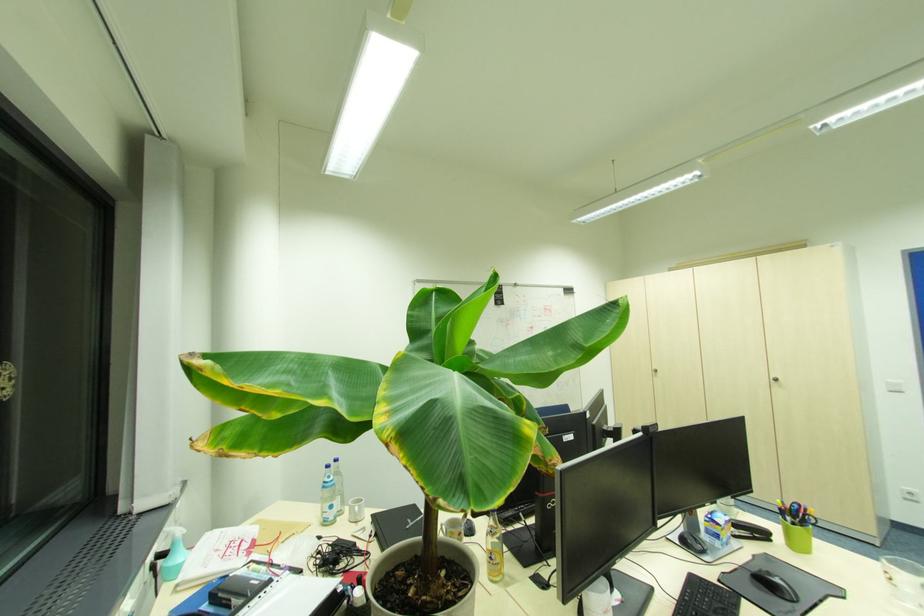
What are the coordinates of `ornate door handle` in the screenshot? It's located at (653, 371).